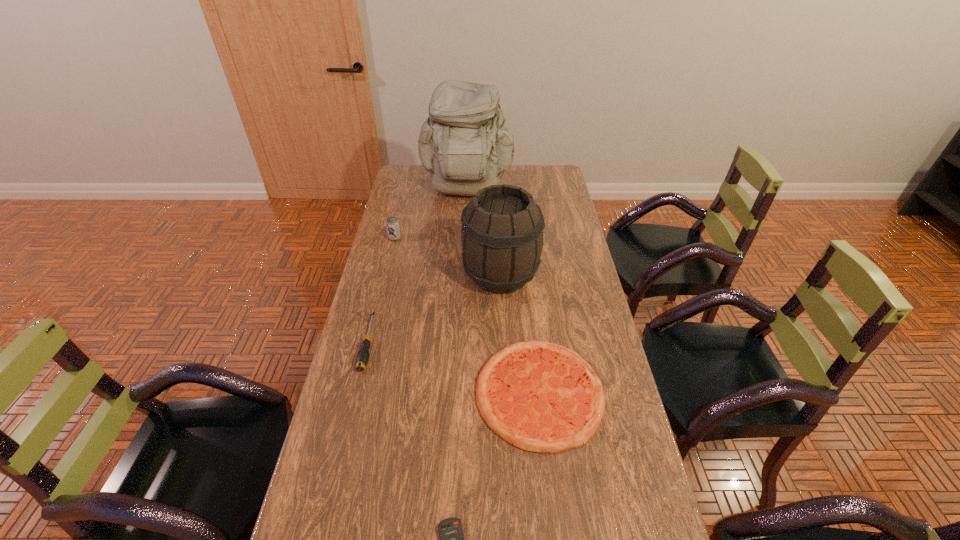
The height and width of the screenshot is (540, 960). I want to click on the tallest object, so click(466, 144).

Where is `backpack`? backpack is located at coordinates (466, 144).

Where is `wine bucket`? Image resolution: width=960 pixels, height=540 pixels. wine bucket is located at coordinates (502, 227).

Where is `the fifth shortest object`? This screenshot has width=960, height=540. the fifth shortest object is located at coordinates (502, 227).

At what (x,y) coordinates should I click in order to perform the action: click on the fourth shortest object. Please return your answer as a coordinate pair (x, y). The width and height of the screenshot is (960, 540). Looking at the image, I should click on (392, 224).

Find the location of a particular element. This screenshot has width=960, height=540. the fifth nearest object is located at coordinates (392, 224).

In order to click on screwdriver in this screenshot , I will do `click(362, 358)`.

Where is `pizza`? pizza is located at coordinates (538, 396).

At what (x,y) coordinates should I click in order to perform the action: click on blank area located 0.340m on the front-facing side of the tallest object. Please return your answer as a coordinate pair (x, y). Looking at the image, I should click on (465, 258).

Image resolution: width=960 pixels, height=540 pixels. In order to click on free space located on the left of the wine bucket in this screenshot , I will do `click(441, 276)`.